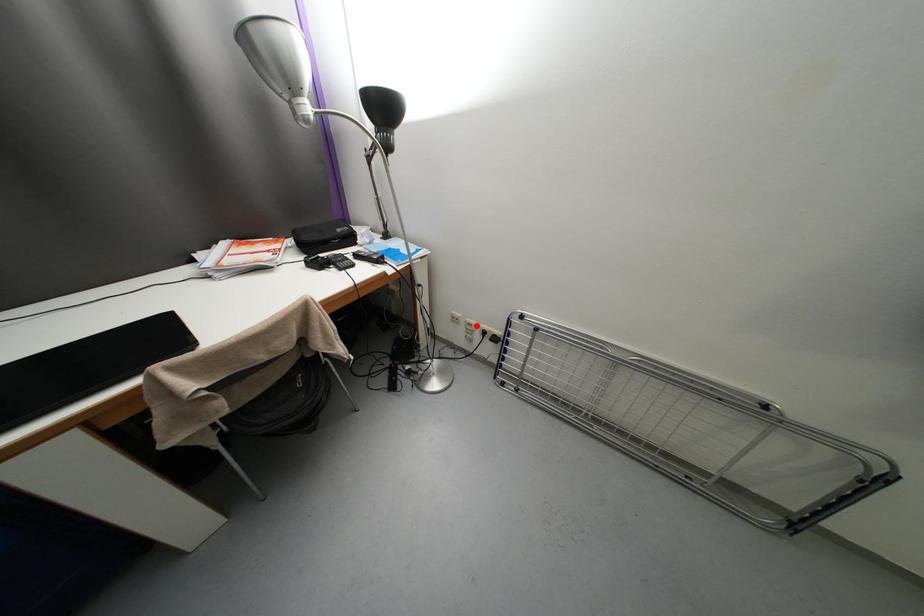
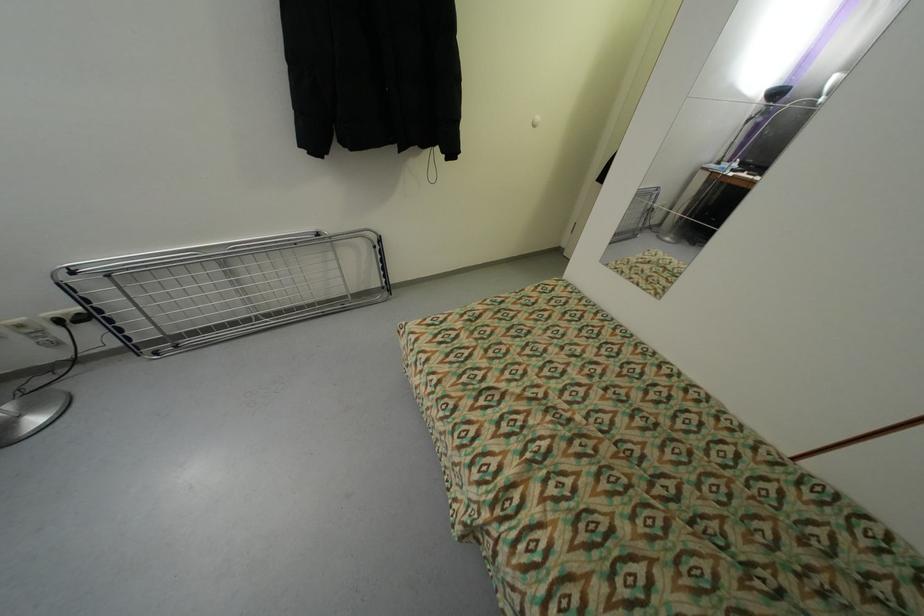
The point at the highlighted location is marked in the first image. Where is the corresponding point in the second image?

(27, 326)